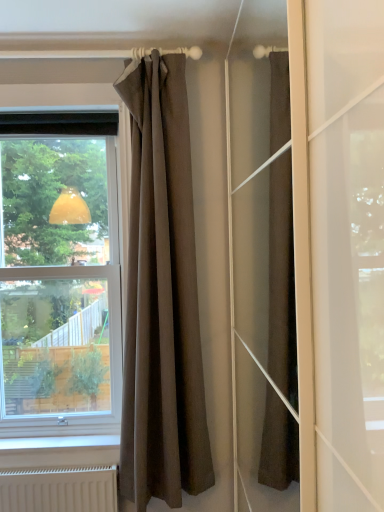
Question: Can you confirm if brown textured curtain at upper center is smaller than transparent glass window at left?

Choices:
 (A) no
 (B) yes

Answer: (B)

Question: Does brown textured curtain at upper center have a lesser height compared to transparent glass window at left?

Choices:
 (A) no
 (B) yes

Answer: (A)

Question: Is brown textured curtain at upper center looking in the opposite direction of transparent glass window at left?

Choices:
 (A) yes
 (B) no

Answer: (B)

Question: Could you tell me if brown textured curtain at upper center is turned towards transparent glass window at left?

Choices:
 (A) no
 (B) yes

Answer: (A)

Question: From a real-world perspective, is brown textured curtain at upper center below transparent glass window at left?

Choices:
 (A) no
 (B) yes

Answer: (B)

Question: Is brown textured curtain at upper center closer to the viewer compared to transparent glass window at left?

Choices:
 (A) no
 (B) yes

Answer: (B)

Question: From a real-world perspective, is transparent glass window at left beneath brown textured curtain at upper center?

Choices:
 (A) no
 (B) yes

Answer: (A)

Question: Can you confirm if transparent glass window at left is taller than brown textured curtain at upper center?

Choices:
 (A) no
 (B) yes

Answer: (A)

Question: Is transparent glass window at left to the left of brown textured curtain at upper center from the viewer's perspective?

Choices:
 (A) no
 (B) yes

Answer: (B)

Question: Is transparent glass window at left positioned in front of brown textured curtain at upper center?

Choices:
 (A) yes
 (B) no

Answer: (B)

Question: Are transparent glass window at left and brown textured curtain at upper center making contact?

Choices:
 (A) no
 (B) yes

Answer: (A)

Question: Is transparent glass window at left facing towards brown textured curtain at upper center?

Choices:
 (A) no
 (B) yes

Answer: (A)

Question: Is transparent glass window at left spatially inside brown textured curtain at upper center, or outside of it?

Choices:
 (A) inside
 (B) outside

Answer: (B)